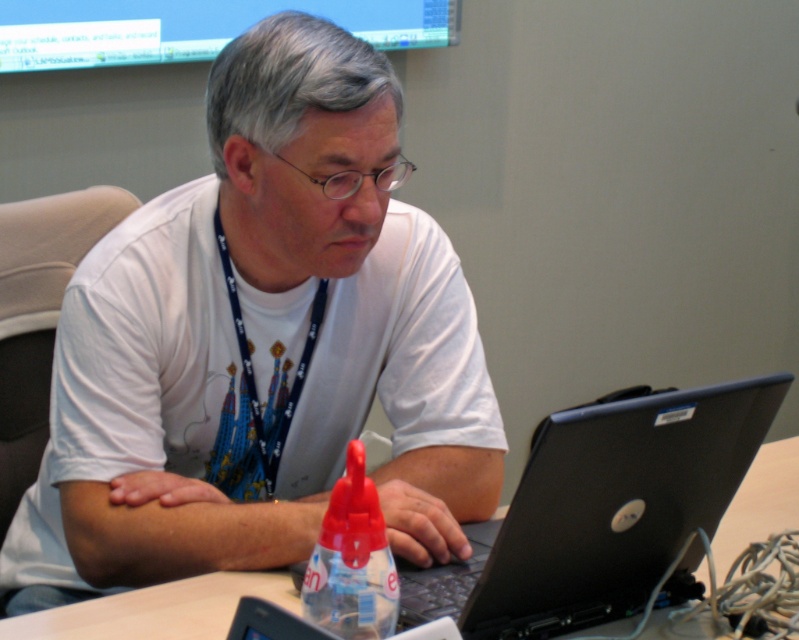
Question: Can you confirm if white matte shirt at center is thinner than blue fabric lanyard at center?

Choices:
 (A) no
 (B) yes

Answer: (A)

Question: Which point appears closest to the camera in this image?

Choices:
 (A) (766, 454)
 (B) (358, 472)

Answer: (B)

Question: Does white matte shirt at center appear on the left side of black plastic laptop at center?

Choices:
 (A) no
 (B) yes

Answer: (B)

Question: Based on their relative distances, which object is nearer to the white matte shirt at center?

Choices:
 (A) black plastic laptop at center
 (B) white matte table at center
 (C) transparent plastic bottle at center

Answer: (A)

Question: Can you confirm if black plastic laptop at center is bigger than transparent plastic bottle at center?

Choices:
 (A) yes
 (B) no

Answer: (A)

Question: Estimate the real-world distances between objects in this image. Which object is closer to the transparent plastic bottle at center?

Choices:
 (A) white matte shirt at center
 (B) blue fabric lanyard at center
 (C) white matte table at center

Answer: (A)